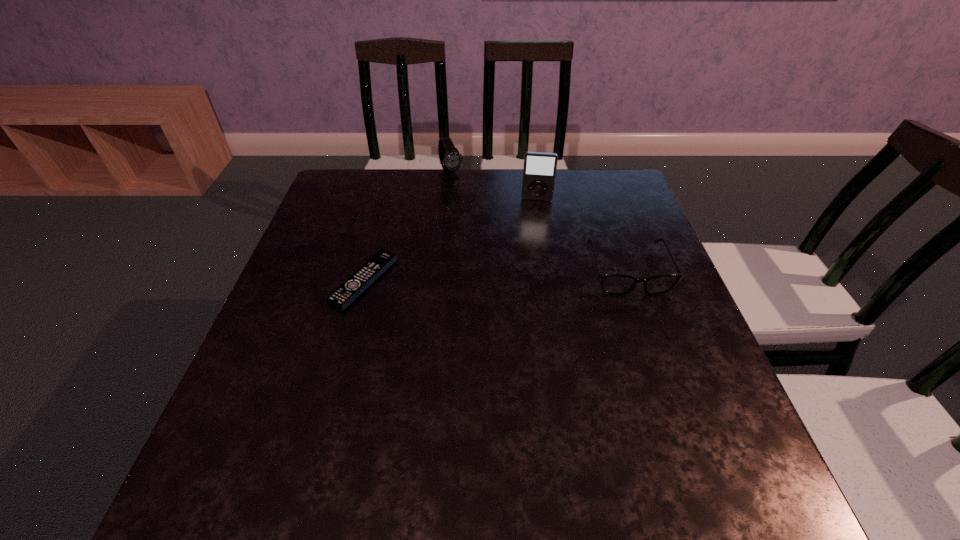
This screenshot has height=540, width=960. Identify the location of vacant area at the far edge. (572, 185).

I want to click on blank area at the left edge, so click(350, 264).

In the image, there is a desktop. In order to click on free space at the right edge in this screenshot , I will do `click(627, 249)`.

This screenshot has height=540, width=960. In order to click on vacant space at the far left corner of the desktop in this screenshot , I will do `click(350, 176)`.

The width and height of the screenshot is (960, 540). In the image, there is a desktop. Find the location of `vacant region at the far right corner`. vacant region at the far right corner is located at coordinates (588, 186).

This screenshot has width=960, height=540. Find the location of `free spot between the remote control and the third nearest object`. free spot between the remote control and the third nearest object is located at coordinates [x=450, y=240].

At what (x,y) coordinates should I click in order to perform the action: click on free space that is in between the second object from right to left and the rightmost object. Please return your answer as a coordinate pair (x, y). Image resolution: width=960 pixels, height=540 pixels. Looking at the image, I should click on (582, 235).

This screenshot has height=540, width=960. Find the location of `free area in between the farthest object and the shortest object`. free area in between the farthest object and the shortest object is located at coordinates (408, 229).

This screenshot has height=540, width=960. I want to click on vacant space that is in between the remote control and the watch, so click(408, 229).

Identify the location of free space between the third tallest object and the third object from left to right. This screenshot has width=960, height=540. 582,235.